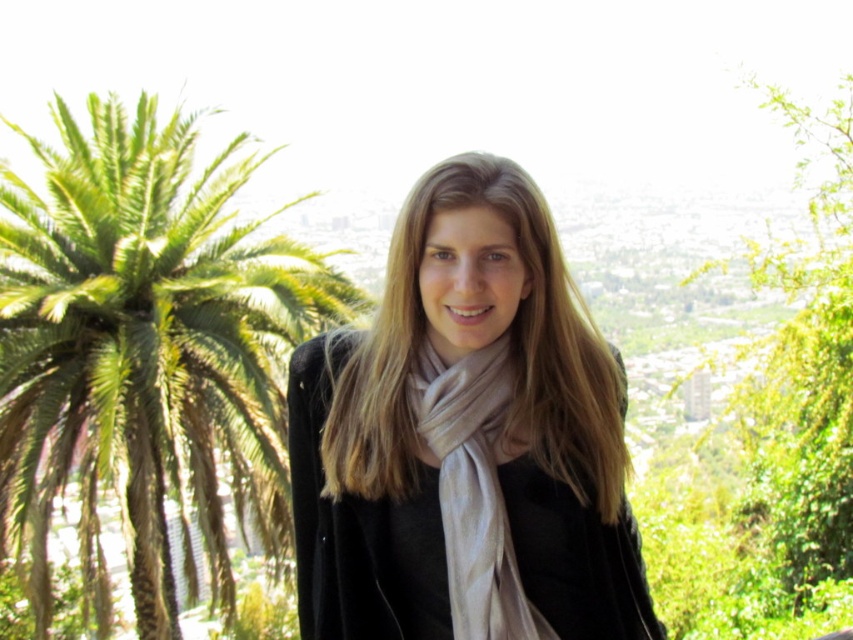
Question: Which point appears farthest from the camera in this image?

Choices:
 (A) (459, 538)
 (B) (178, 282)

Answer: (A)

Question: Can you confirm if green leafy palm tree at left is positioned to the right of beige silk scarf at center?

Choices:
 (A) yes
 (B) no

Answer: (B)

Question: Is matte black scarf at center positioned at the back of green leafy palm tree at left?

Choices:
 (A) no
 (B) yes

Answer: (B)

Question: Is matte black scarf at center above green leafy palm tree at left?

Choices:
 (A) no
 (B) yes

Answer: (A)

Question: Estimate the real-world distances between objects in this image. Which object is farther from the green leafy palm tree at left?

Choices:
 (A) beige silk scarf at center
 (B) matte black scarf at center

Answer: (A)

Question: Which point is farther from the camera taking this photo?

Choices:
 (A) (270, 550)
 (B) (515, 593)
 (C) (554, 264)

Answer: (A)